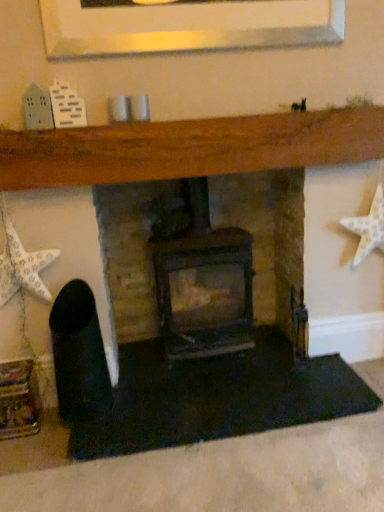
Question: From their relative heights in the image, would you say white matte starfish at right, the 2th starfish positioned from the left, is taller or shorter than white paper star at left, the 1th starfish from the left?

Choices:
 (A) short
 (B) tall

Answer: (B)

Question: Looking at the image, does white matte starfish at right, the 2th starfish positioned from the left, seem bigger or smaller compared to white paper star at left, the 1th starfish from the left?

Choices:
 (A) big
 (B) small

Answer: (B)

Question: Estimate the real-world distances between objects in this image. Which object is farther from the rustic stone fireplace at center?

Choices:
 (A) white paper star at left, which appears as the second starfish when viewed from the right
 (B) white matte starfish at right, the 1th starfish from the right
 (C) dark brown wood burning stove at center

Answer: (C)

Question: Estimate the real-world distances between objects in this image. Which object is farther from the white paper star at left, which appears as the second starfish when viewed from the right?

Choices:
 (A) rustic stone fireplace at center
 (B) white matte starfish at right, the 1th starfish from the right
 (C) dark brown wood burning stove at center

Answer: (B)